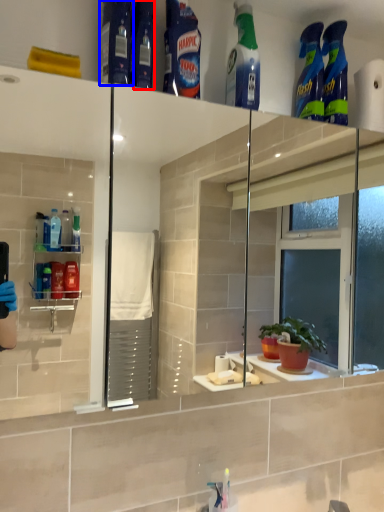
Question: Among these objects, which one is nearest to the camera, toiletry (highlighted by a red box) or cleaning product (highlighted by a blue box)?

Choices:
 (A) toiletry
 (B) cleaning product

Answer: (B)